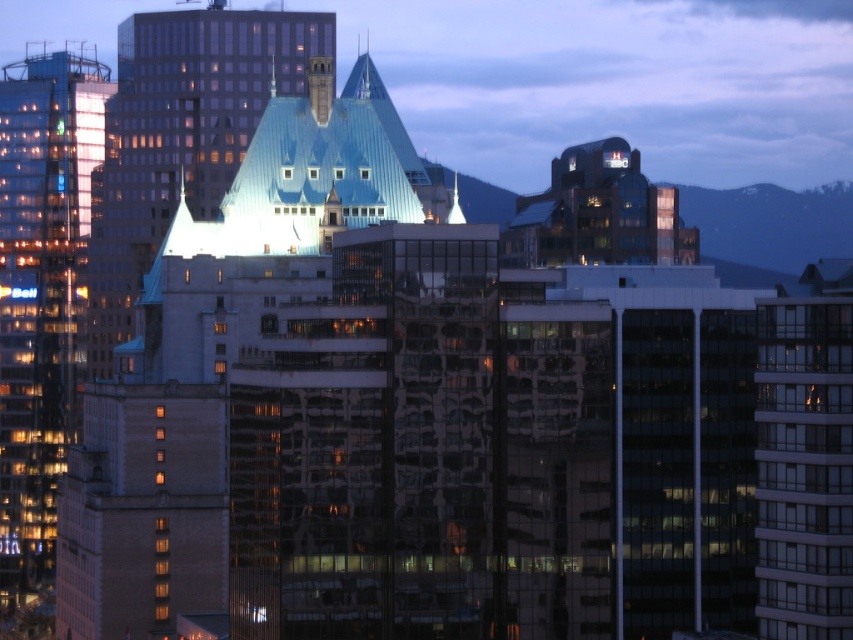
Question: Is glassy reflective skyscraper at left above blue glass building at center?

Choices:
 (A) yes
 (B) no

Answer: (B)

Question: Is glassy reflective skyscraper at left to the right of blue glass building at center from the viewer's perspective?

Choices:
 (A) yes
 (B) no

Answer: (B)

Question: Is the position of glassy reflective skyscraper at left more distant than that of blue glass building at center?

Choices:
 (A) no
 (B) yes

Answer: (B)

Question: Which object is farther from the camera taking this photo?

Choices:
 (A) glassy reflective skyscraper at left
 (B) blue glass building at center

Answer: (A)

Question: Which object is farther from the camera taking this photo?

Choices:
 (A) glassy reflective skyscraper at left
 (B) blue glass building at center

Answer: (A)

Question: Which object appears farthest from the camera in this image?

Choices:
 (A) glassy reflective skyscraper at left
 (B) blue glass building at center

Answer: (A)